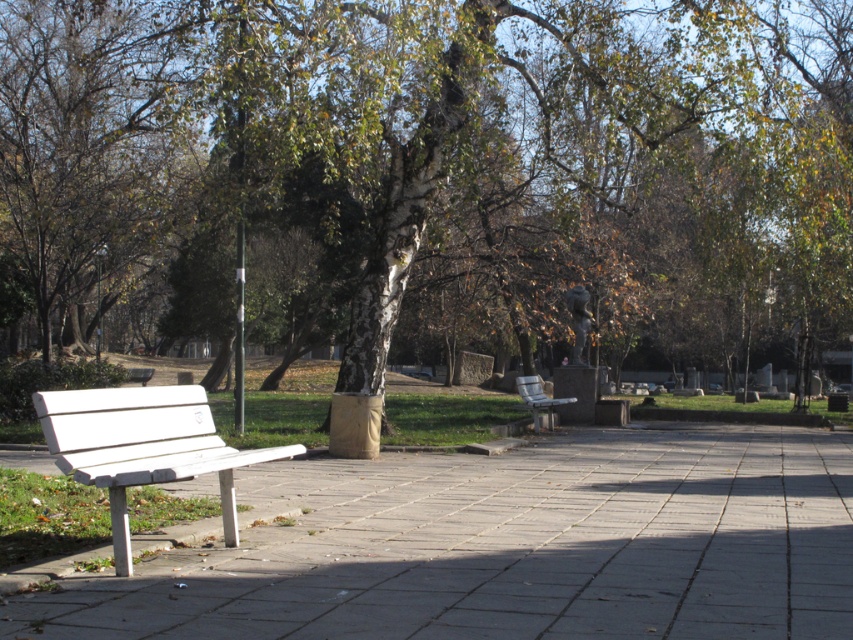
Question: Does white concrete pavement at center have a larger size compared to white plastic bench at lower left?

Choices:
 (A) yes
 (B) no

Answer: (A)

Question: Is white bark tree at center below white plastic bench at lower left?

Choices:
 (A) no
 (B) yes

Answer: (A)

Question: Which object appears farthest from the camera in this image?

Choices:
 (A) white plastic bench at lower left
 (B) white concrete pavement at center
 (C) wooden bench at center

Answer: (C)

Question: Which object is positioned closest to the wooden bench at center?

Choices:
 (A) white bark tree at center
 (B) white concrete pavement at center
 (C) white plastic bench at lower left

Answer: (B)

Question: Which point is closer to the camera?

Choices:
 (A) (215, 444)
 (B) (88, 195)
 (C) (526, 376)

Answer: (A)

Question: Is white bark tree at center positioned at the back of wooden bench at center?

Choices:
 (A) yes
 (B) no

Answer: (B)